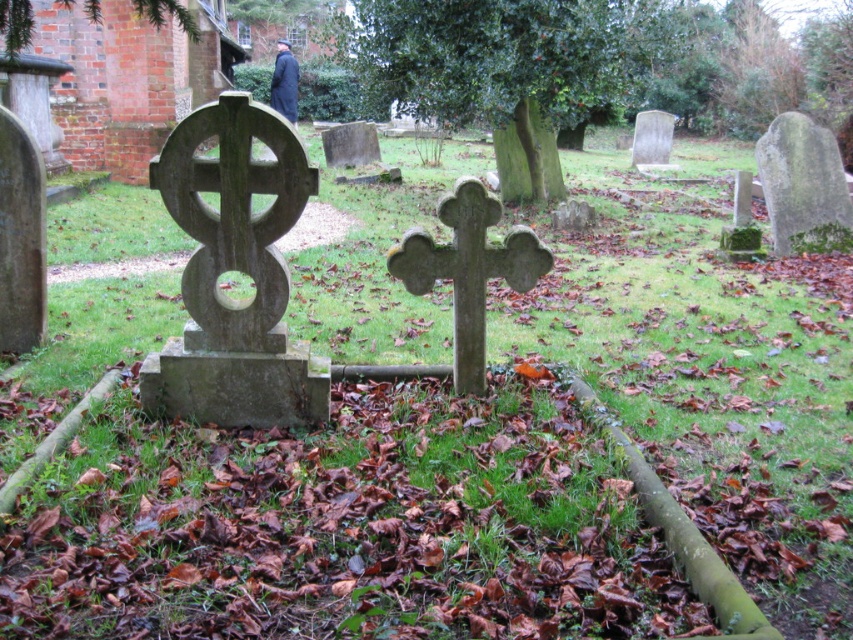
Who is higher up, dark gray stone cross at center or dark wool coat at upper center?

dark wool coat at upper center is above.

Who is taller, dark gray stone cross at center or dark wool coat at upper center?

Standing taller between the two is dark wool coat at upper center.

Is point (485, 193) more distant than point (291, 61)?

No, (485, 193) is closer to viewer.

Locate an element on the screen. The width and height of the screenshot is (853, 640). dark gray stone cross at center is located at coordinates (468, 269).

Locate an element on the screen. This screenshot has height=640, width=853. green stone cross at center is located at coordinates (233, 220).

This screenshot has width=853, height=640. What do you see at coordinates (233, 220) in the screenshot? I see `green stone cross at center` at bounding box center [233, 220].

Which is in front, point (279, 314) or point (283, 109)?

Point (279, 314) is more forward.

Locate an element on the screen. The image size is (853, 640). green stone cross at center is located at coordinates (233, 220).

Does dark gray stone cross at center appear on the left side of smooth gray stone cross at center?

Incorrect, dark gray stone cross at center is not on the left side of smooth gray stone cross at center.

Which is behind, point (407, 268) or point (354, 129)?

Point (354, 129)

Find the location of `dark gray stone cross at center`. dark gray stone cross at center is located at coordinates (468, 269).